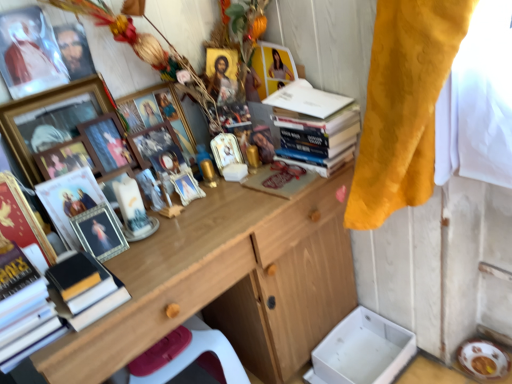
The width and height of the screenshot is (512, 384). I want to click on empty space that is ontop of wooden desk at center (from a real-world perspective), so click(x=198, y=217).